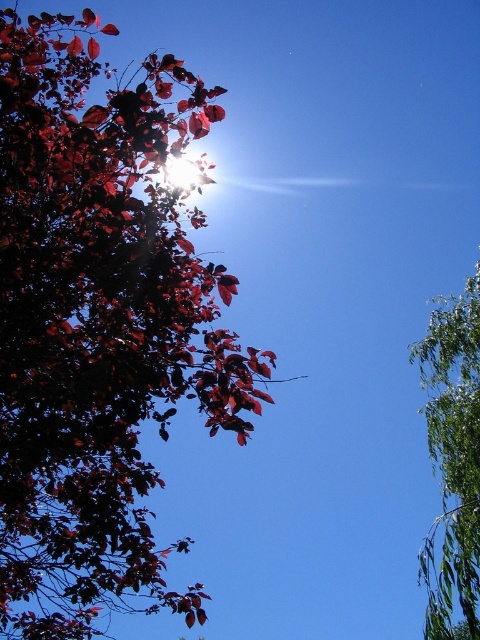
You are standing in the middle of the scene and want to pick up both the shiny red leaves at upper left and the green leafy branch at right. Which object is farther away from you?

The shiny red leaves at upper left is 11.42 meters away from the green leafy branch at right. Since you are standing in the middle, both objects are equidistant from you, but the distance between them is 11.42 meters.

You are an artist painting this scene and want to ensure the positioning of the shiny red leaves at upper left and the green leafy branch at right is accurate. Based on the scene description, which object is positioned to the left of the other?

The shiny red leaves at upper left are positioned to the left of the green leafy branch at right.